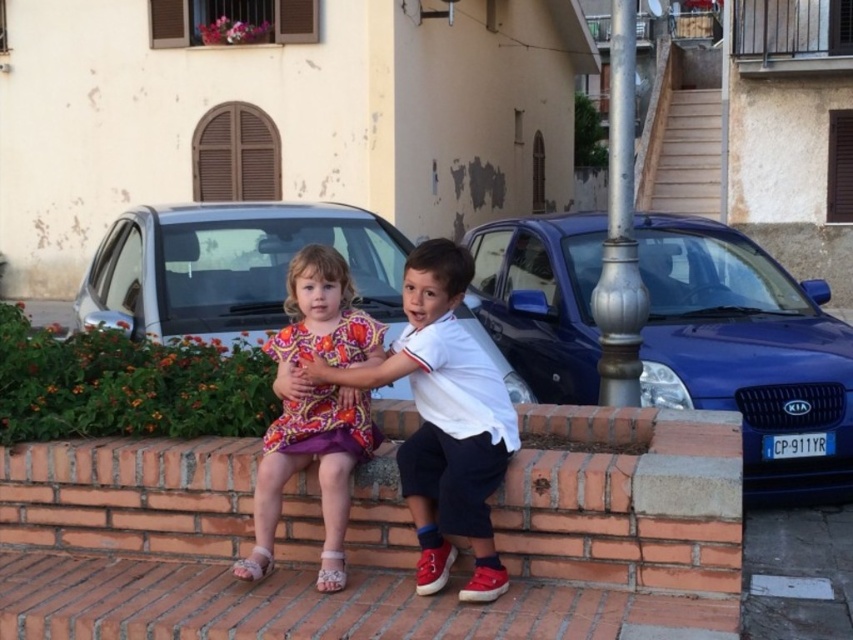
Can you confirm if blue metallic car at right is shorter than silver metallic car at center?

Incorrect, blue metallic car at right's height does not fall short of silver metallic car at center's.

Between blue metallic car at right and silver metallic car at center, which one has more height?

blue metallic car at right is taller.

Who is more forward, (728, 337) or (315, 236)?

Positioned in front is point (728, 337).

Image resolution: width=853 pixels, height=640 pixels. I want to click on blue metallic car at right, so click(747, 355).

Which is above, brick at lower center or silver metallic car at center?

Positioned higher is silver metallic car at center.

Image resolution: width=853 pixels, height=640 pixels. I want to click on brick at lower center, so click(x=376, y=538).

Is blue metallic car at right positioned at the back of white cotton shirt at center?

Yes, it is.

Which is in front, point (718, 310) or point (469, 600)?

Point (469, 600)

The width and height of the screenshot is (853, 640). Describe the element at coordinates (747, 355) in the screenshot. I see `blue metallic car at right` at that location.

Find the location of a particular element. blue metallic car at right is located at coordinates (747, 355).